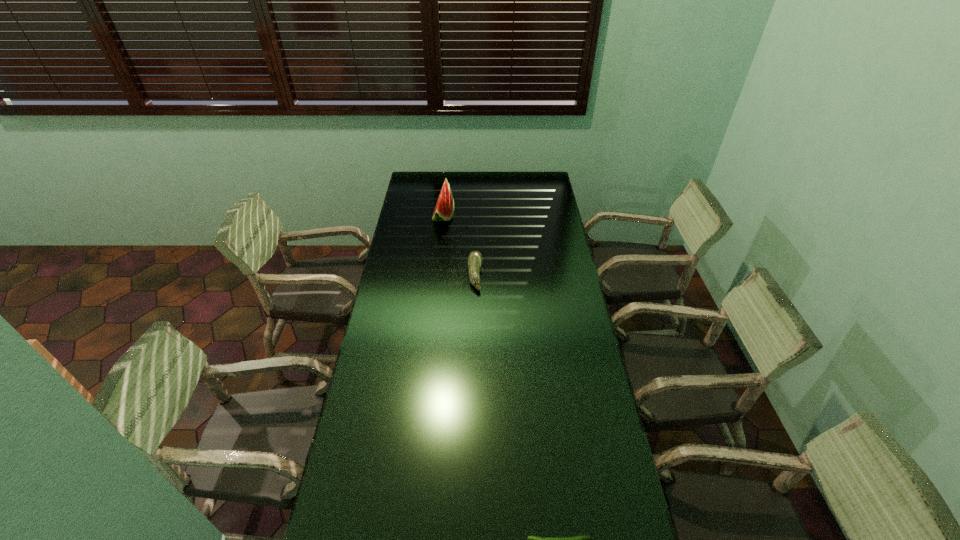
In the image, there is a desktop. At what (x,y) coordinates should I click in order to perform the action: click on vacant space at the far right corner. Please return your answer as a coordinate pair (x, y). This screenshot has width=960, height=540. Looking at the image, I should click on (540, 177).

The height and width of the screenshot is (540, 960). Find the location of `free space between the second farthest object and the leftmost object`. free space between the second farthest object and the leftmost object is located at coordinates (459, 246).

Where is `vacant area between the second tallest object and the farthest object`? The image size is (960, 540). vacant area between the second tallest object and the farthest object is located at coordinates (459, 246).

At what (x,y) coordinates should I click in order to perform the action: click on empty space that is in between the leftmost object and the taller zucchini. Please return your answer as a coordinate pair (x, y). Looking at the image, I should click on (459, 246).

Locate an element on the screen. This screenshot has height=540, width=960. object that ranks as the closest to the tallest object is located at coordinates (475, 258).

Select which object is the closest to the nearest object. Please provide its 2D coordinates. Your answer should be formatted as a tuple, i.e. [(x, y)], where the tuple contains the x and y coordinates of a point satisfying the conditions above.

[(475, 258)]